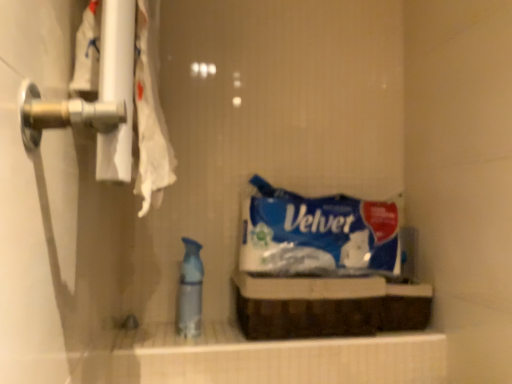
Where is `unoccupied region to the right of translucent plastic spray bottle at center`? This screenshot has height=384, width=512. unoccupied region to the right of translucent plastic spray bottle at center is located at coordinates (233, 338).